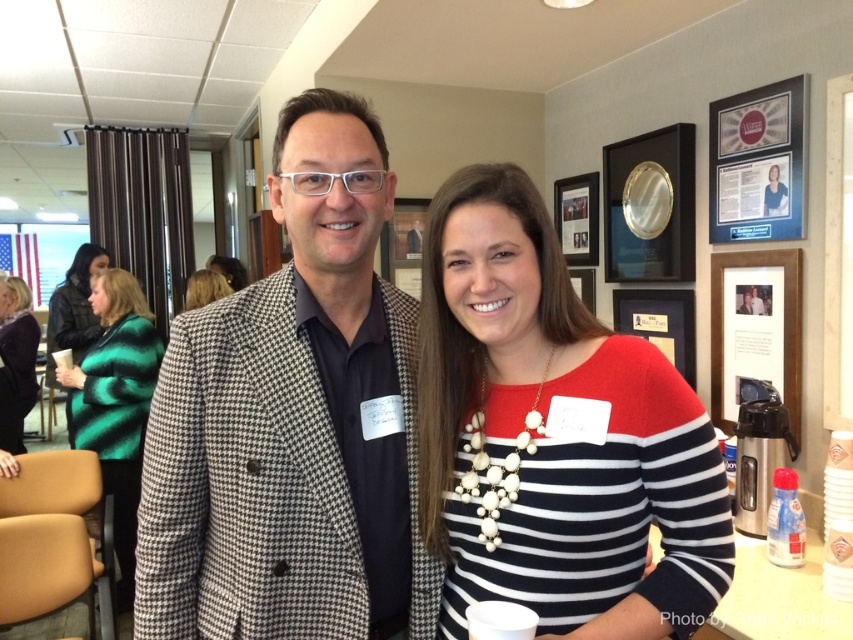
Who is shorter, houndstooth fabric blazer at center or striped knit sweater at center?

With less height is striped knit sweater at center.

Which is in front, point (361, 540) or point (567, 490)?

Point (567, 490) is more forward.

I want to click on houndstooth fabric blazer at center, so click(x=292, y=422).

Is patterned blazer at center to the left of green striped sweater at left from the viewer's perspective?

Incorrect, patterned blazer at center is not on the left side of green striped sweater at left.

Does point (480, 429) come farther from viewer compared to point (126, 298)?

No.

What are the coordinates of `patterned blazer at center` in the screenshot? It's located at (426, 433).

Is point (409, 416) behind point (221, 278)?

No, it is not.

The image size is (853, 640). What do you see at coordinates (292, 422) in the screenshot?
I see `houndstooth fabric blazer at center` at bounding box center [292, 422].

This screenshot has height=640, width=853. Identify the location of houndstooth fabric blazer at center. (292, 422).